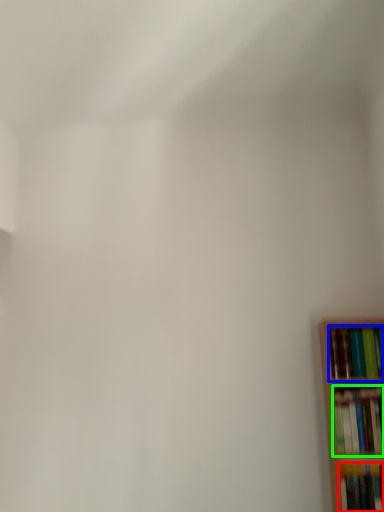
Question: Which object is positioned closest to book (highlighted by a red box)? Select from book (highlighted by a blue box) and book (highlighted by a green box).

Choices:
 (A) book
 (B) book

Answer: (B)